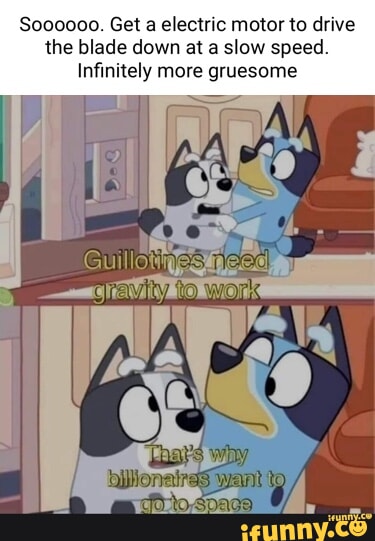
Locate an element on the screen. The height and width of the screenshot is (541, 375). rug is located at coordinates (329, 276).